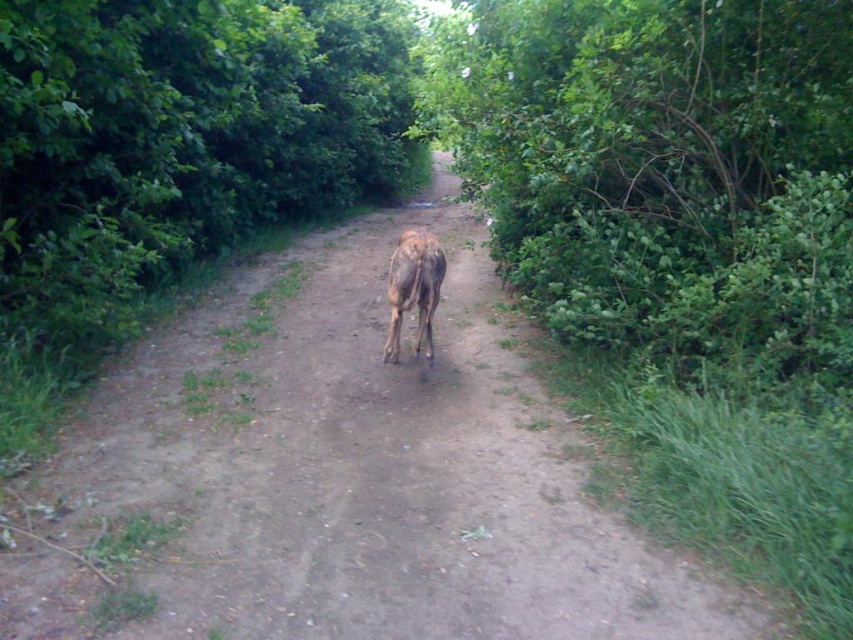
Between point (318, 180) and point (425, 323), which one is positioned in front?

Point (425, 323) is in front.

The image size is (853, 640). What do you see at coordinates (184, 131) in the screenshot?
I see `green leafy tree at center` at bounding box center [184, 131].

This screenshot has height=640, width=853. What are the coordinates of `green leafy tree at center` in the screenshot? It's located at (184, 131).

Who is lower down, green leafy bush at right or green leafy tree at center?

Positioned lower is green leafy tree at center.

Is point (572, 262) behind point (131, 81)?

No, (572, 262) is in front of (131, 81).

This screenshot has width=853, height=640. I want to click on green leafy bush at right, so click(x=660, y=164).

Is brown textured dirt path at center below green leafy tree at center?

Yes, brown textured dirt path at center is below green leafy tree at center.

Consider the image. Is brown textured dirt path at center further to camera compared to green leafy tree at center?

No.

Is point (344, 440) in front of point (242, 198)?

Yes, point (344, 440) is in front of point (242, 198).

The width and height of the screenshot is (853, 640). Find the location of `brown textured dirt path at center`. brown textured dirt path at center is located at coordinates (340, 480).